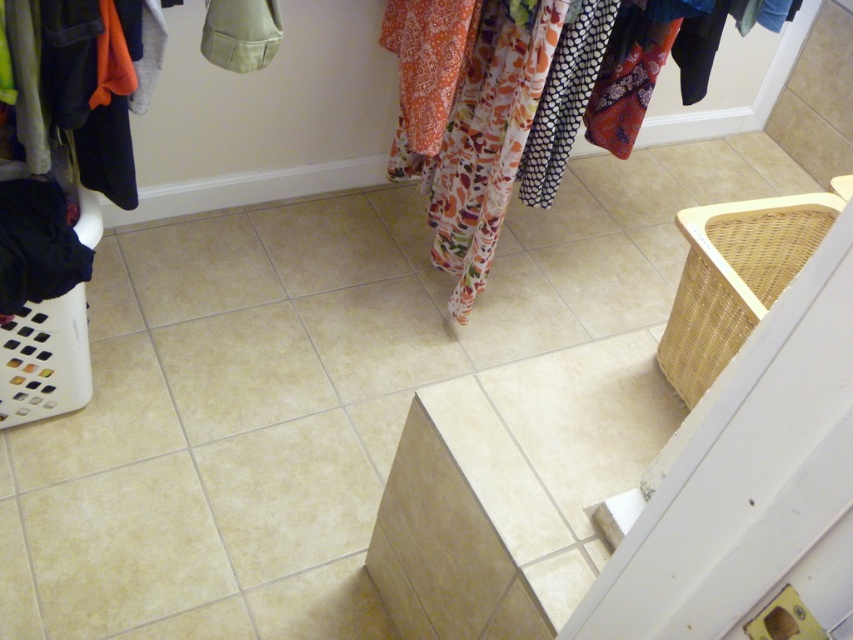
Question: Is woven beige laundry basket at right positioned at the back of white plastic laundry basket at lower left?

Choices:
 (A) yes
 (B) no

Answer: (B)

Question: Among these points, which one is farthest from the camera?

Choices:
 (A) (93, 196)
 (B) (126, 161)
 (C) (541, 74)
 (D) (747, 243)

Answer: (D)

Question: Is floral fabric clothes at upper center positioned before white plastic laundry basket at lower left?

Choices:
 (A) yes
 (B) no

Answer: (B)

Question: Which point is farther from the camera taking this photo?

Choices:
 (A) (57, 323)
 (B) (821, 230)

Answer: (B)

Question: Which point is farther to the camera?

Choices:
 (A) (465, 108)
 (B) (36, 337)

Answer: (A)

Question: Does floral fabric clothes at upper center have a smaller size compared to woven beige laundry basket at right?

Choices:
 (A) no
 (B) yes

Answer: (A)